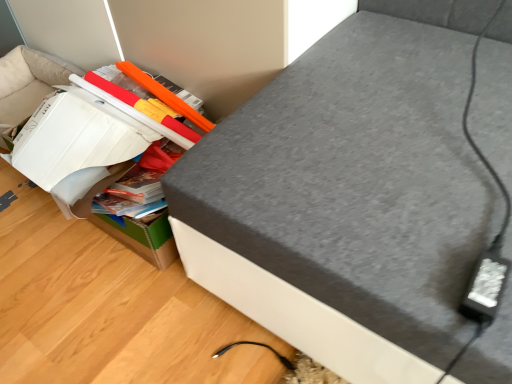
Question: Is cardboard box at lower left shorter than grey fabric ottoman at upper right?

Choices:
 (A) yes
 (B) no

Answer: (A)

Question: Is cardboard box at lower left to the left of grey fabric ottoman at upper right from the viewer's perspective?

Choices:
 (A) yes
 (B) no

Answer: (A)

Question: Is cardboard box at lower left closer to the viewer compared to grey fabric ottoman at upper right?

Choices:
 (A) yes
 (B) no

Answer: (B)

Question: Is cardboard box at lower left wider than grey fabric ottoman at upper right?

Choices:
 (A) no
 (B) yes

Answer: (A)

Question: From the image's perspective, would you say cardboard box at lower left is positioned over grey fabric ottoman at upper right?

Choices:
 (A) yes
 (B) no

Answer: (B)

Question: Is cardboard box at lower left facing towards grey fabric ottoman at upper right?

Choices:
 (A) no
 (B) yes

Answer: (A)

Question: From the image's perspective, would you say grey fabric ottoman at upper right is shown under cardboard box at lower left?

Choices:
 (A) yes
 (B) no

Answer: (B)

Question: Does grey fabric ottoman at upper right have a lesser height compared to cardboard box at lower left?

Choices:
 (A) yes
 (B) no

Answer: (B)

Question: From the image's perspective, is grey fabric ottoman at upper right over cardboard box at lower left?

Choices:
 (A) yes
 (B) no

Answer: (A)

Question: Is grey fabric ottoman at upper right smaller than cardboard box at lower left?

Choices:
 (A) yes
 (B) no

Answer: (B)

Question: Can you confirm if grey fabric ottoman at upper right is bigger than cardboard box at lower left?

Choices:
 (A) yes
 (B) no

Answer: (A)

Question: Considering the relative positions of grey fabric ottoman at upper right and cardboard box at lower left in the image provided, is grey fabric ottoman at upper right in front of cardboard box at lower left?

Choices:
 (A) no
 (B) yes

Answer: (B)

Question: From a real-world perspective, is grey fabric ottoman at upper right positioned above or below cardboard box at lower left?

Choices:
 (A) below
 (B) above

Answer: (B)